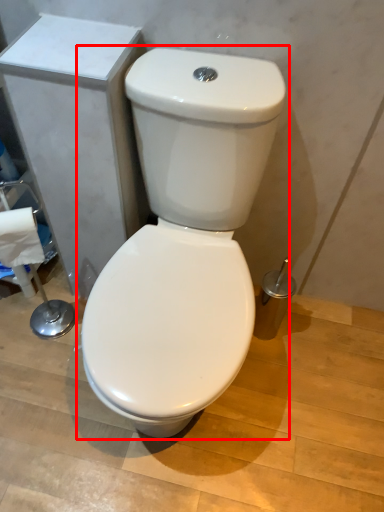
Question: Observing the image, what is the correct spatial positioning of toilet (annotated by the red box) in reference to toilet paper?

Choices:
 (A) left
 (B) right

Answer: (B)